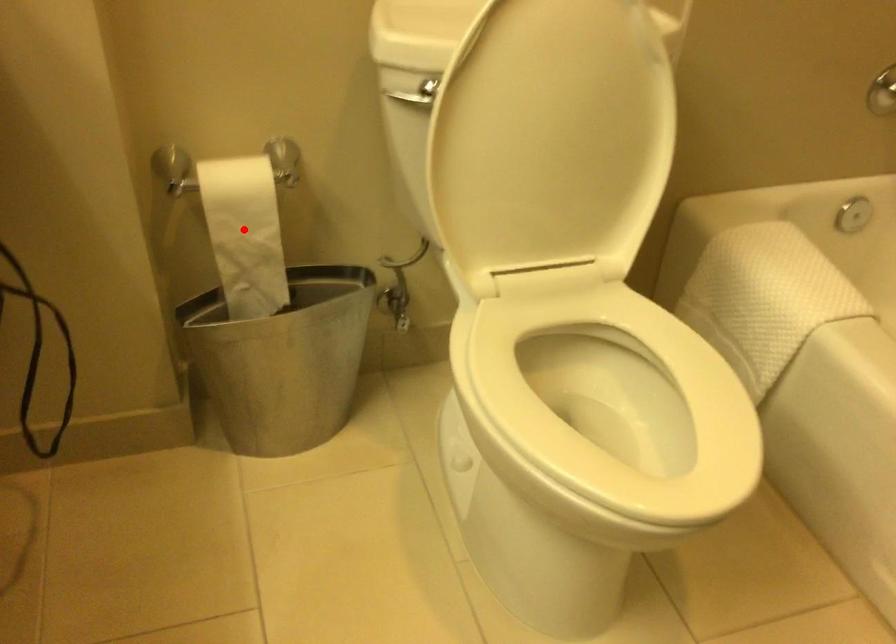
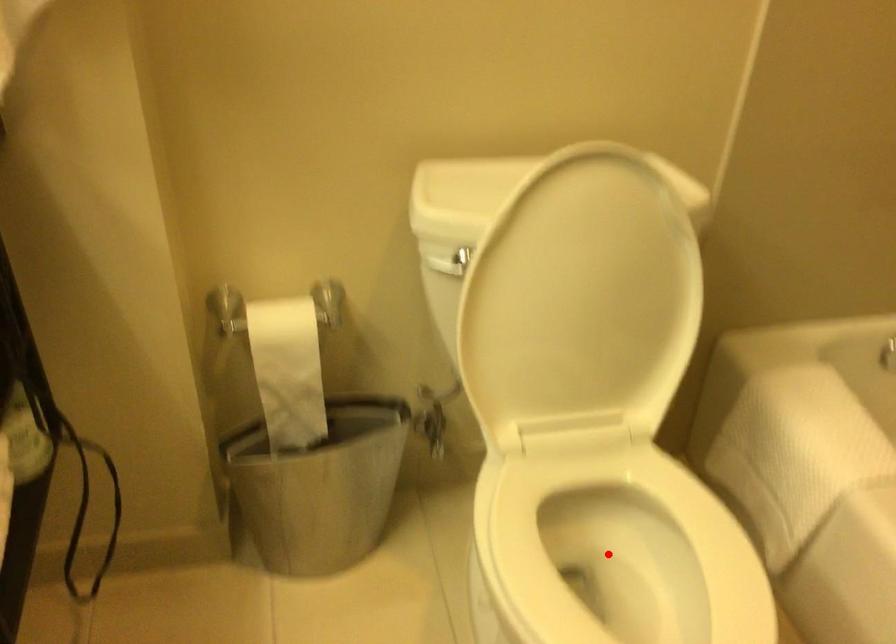
I am providing you with two images of the same scene from different viewpoints. A red point is marked on the first image and another point is marked on the second image. Are the points marked in image1 and image2 representing the same 3D position?

No